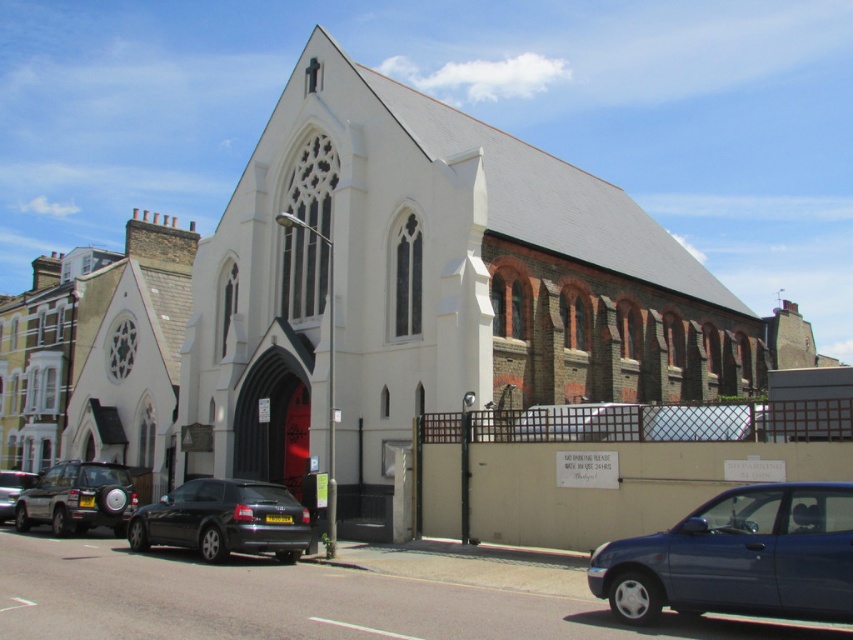
You are a visitor arriving at the church and see the metallic blue sedan at lower right and the matte black car at lower left parked in the parking lot. Which car is closer to the red brick section on the right side of the church?

The metallic blue sedan at lower right is closer to the red brick section on the right side of the church because it is positioned to the right of the matte black car at lower left.

You are a photographer planning to take a wide shot of the white stone chapel at center and the metallic blue sedan at lower right. Given that the chapel is larger, where should you position yourself to ensure both are visible in the frame?

Since the white stone chapel at center is larger than the metallic blue sedan at lower right, positioning yourself further away from the chapel will help balance their sizes in the photograph, ensuring both are visible in the frame.

You are a visitor arriving at the church and need to park your car. You see a metallic blue sedan at lower right and a matte black car at lower left. Which parking spot would allow you to park closer to the entrance?

The metallic blue sedan at lower right occupies less space than matte black car at lower left, so parking closer to the entrance would be possible near the metallic blue sedan at lower right.